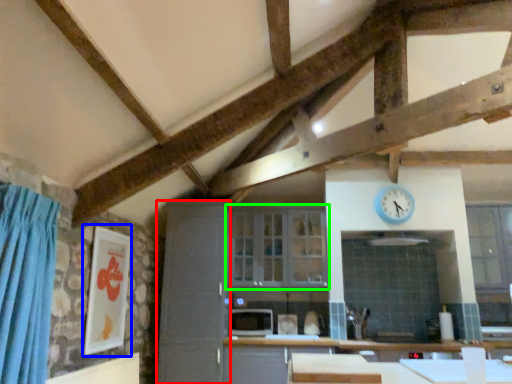
Question: Estimate the real-world distances between objects in this image. Which object is closer to cabinetry (highlighted by a red box), picture frame (highlighted by a blue box) or window (highlighted by a green box)?

Choices:
 (A) picture frame
 (B) window

Answer: (B)